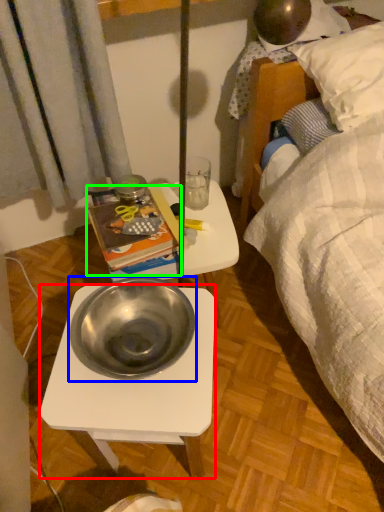
Question: Which object is the farthest from desk (highlighted by a red box)? Choose among these: bowl (highlighted by a blue box) or paperback book (highlighted by a green box).

Choices:
 (A) bowl
 (B) paperback book

Answer: (B)